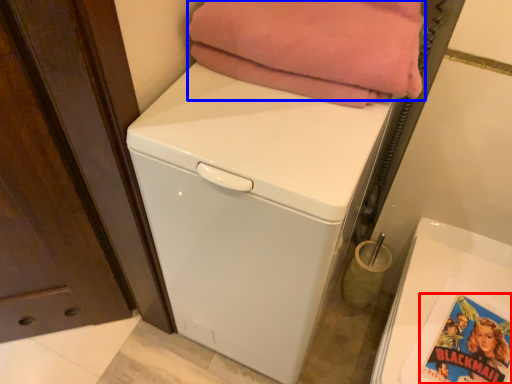
Question: Which object appears closest to the camera in this image, comic book (highlighted by a red box) or blanket (highlighted by a blue box)?

Choices:
 (A) comic book
 (B) blanket

Answer: (B)